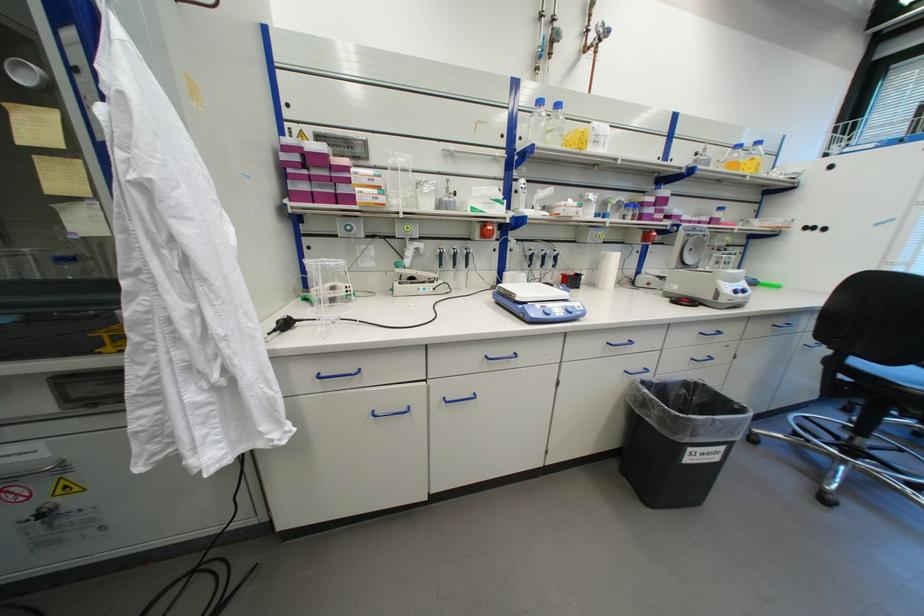
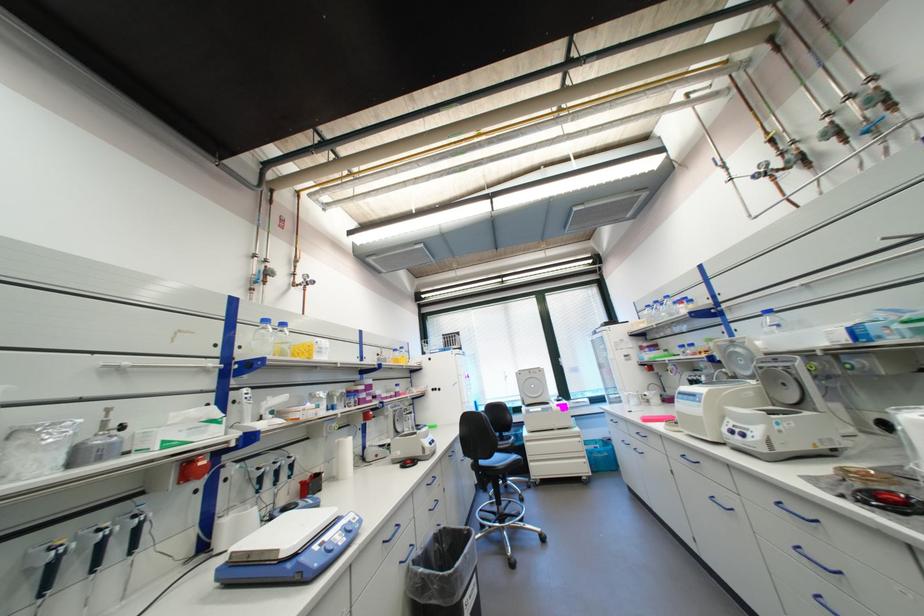
Where in the second image is the point corresponding to point 524,192 from the first image?

(242, 403)